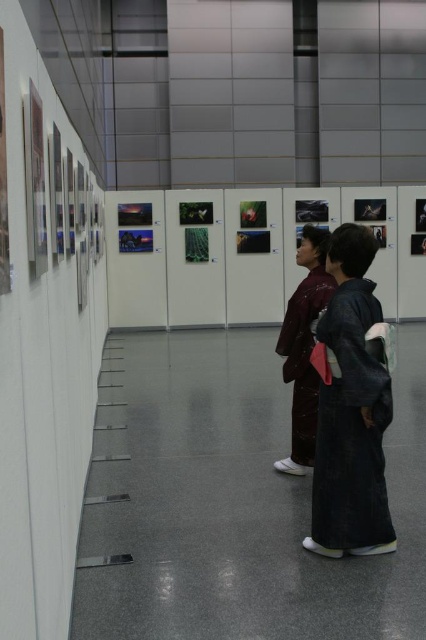
Who is taller, dark gray kimono at center or matte brown kimono at center?

matte brown kimono at center

Can you confirm if dark gray kimono at center is positioned below matte brown kimono at center?

Correct, dark gray kimono at center is located below matte brown kimono at center.

Between point (354, 312) and point (299, 323), which one is positioned in front?

Point (354, 312) is more forward.

Locate an element on the screen. This screenshot has height=640, width=426. dark gray kimono at center is located at coordinates click(x=351, y=428).